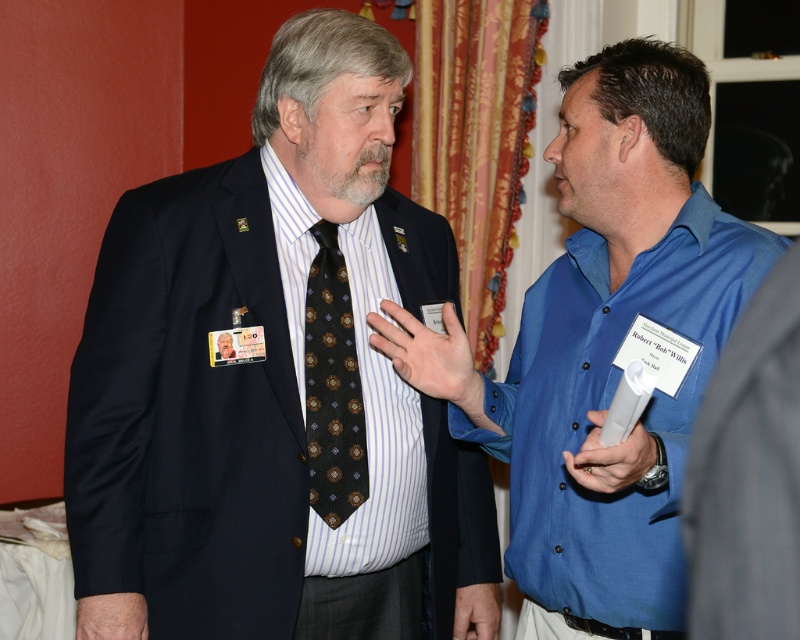
You are a tailor observing the two men in the scene. You need to determine which item is layered on top of the other between the matte black suit at center and the dark brown silk tie at center. Which one is on top?

The matte black suit at center is positioned over dark brown silk tie at center, so the matte black suit at center is on top.